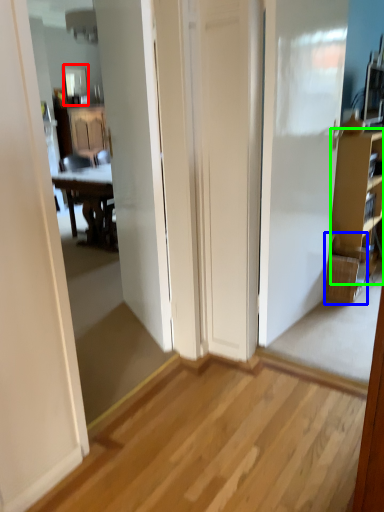
Question: Which object is the farthest from mirror (highlighted by a red box)? Choose among these: picnic basket (highlighted by a blue box) or cabinetry (highlighted by a green box).

Choices:
 (A) picnic basket
 (B) cabinetry

Answer: (A)